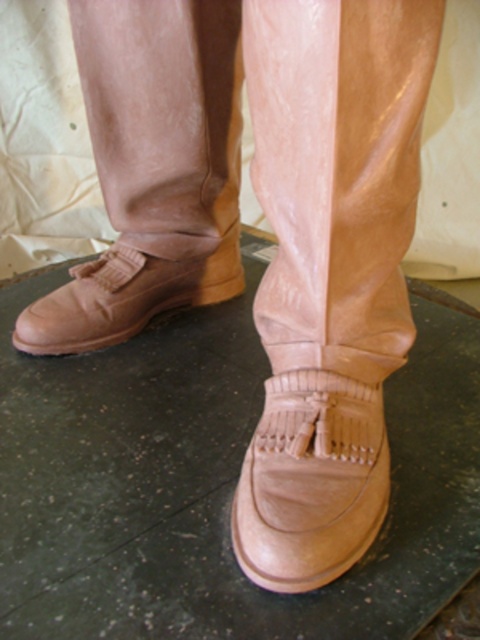
Question: Does matte tan boot at lower left have a larger size compared to leather boot at lower center?

Choices:
 (A) yes
 (B) no

Answer: (A)

Question: Considering the relative positions of matte tan boot at lower left and leather boot at lower center in the image provided, where is matte tan boot at lower left located with respect to leather boot at lower center?

Choices:
 (A) above
 (B) below

Answer: (A)

Question: Among these objects, which one is nearest to the camera?

Choices:
 (A) matte tan boot at lower left
 (B) leather boot at lower center

Answer: (B)

Question: Does matte tan boot at lower left appear over leather boot at lower center?

Choices:
 (A) yes
 (B) no

Answer: (A)